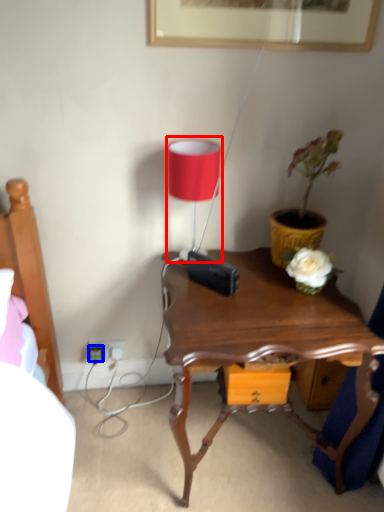
Question: Which object appears farthest to the camera in this image, table lamp (highlighted by a red box) or plug (highlighted by a blue box)?

Choices:
 (A) table lamp
 (B) plug

Answer: (B)